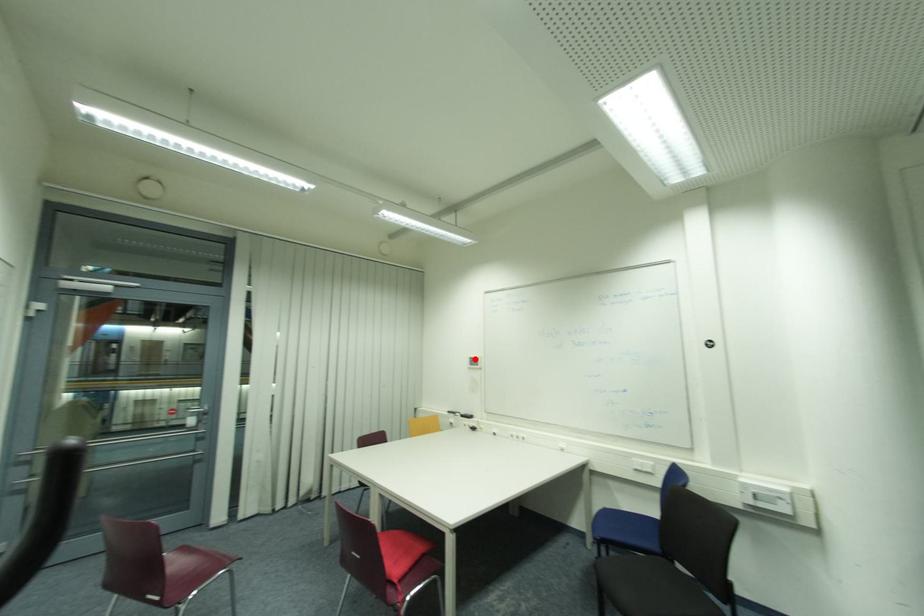
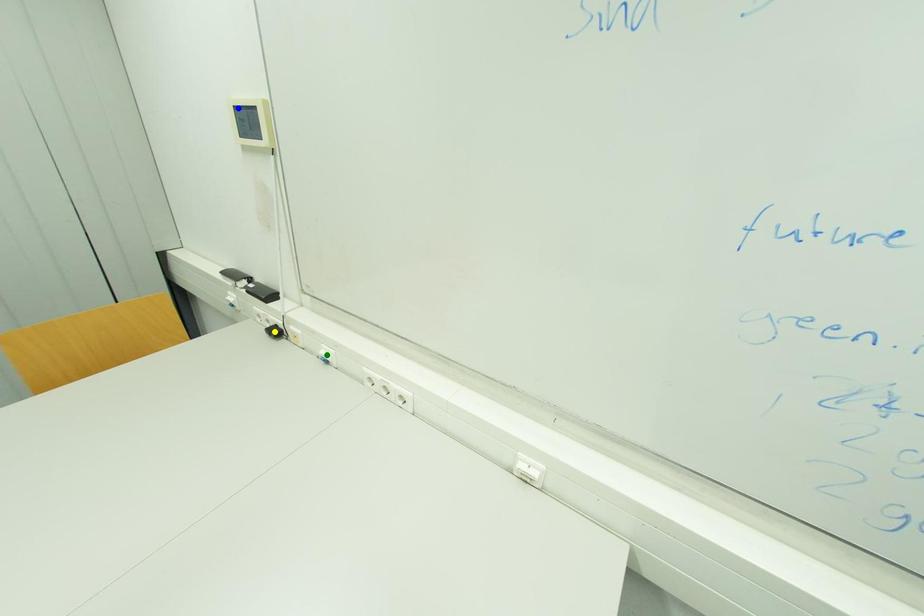
Question: I am providing you with two images of the same scene from different viewpoints. A red point is marked on the first image. You are given multiple points on the second image. Can you choose the point in image 2 that corresponds to the point in image 1?

Choices:
 (A) green point
 (B) blue point
 (C) yellow point

Answer: (B)